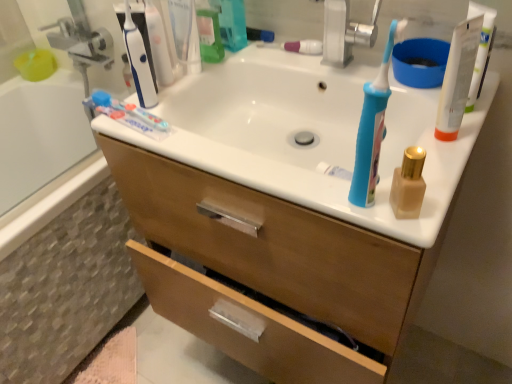
Find the location of a particular element. free location in front of pink glossy toothpaste at center, the 1th toothpaste from the right is located at coordinates (326, 71).